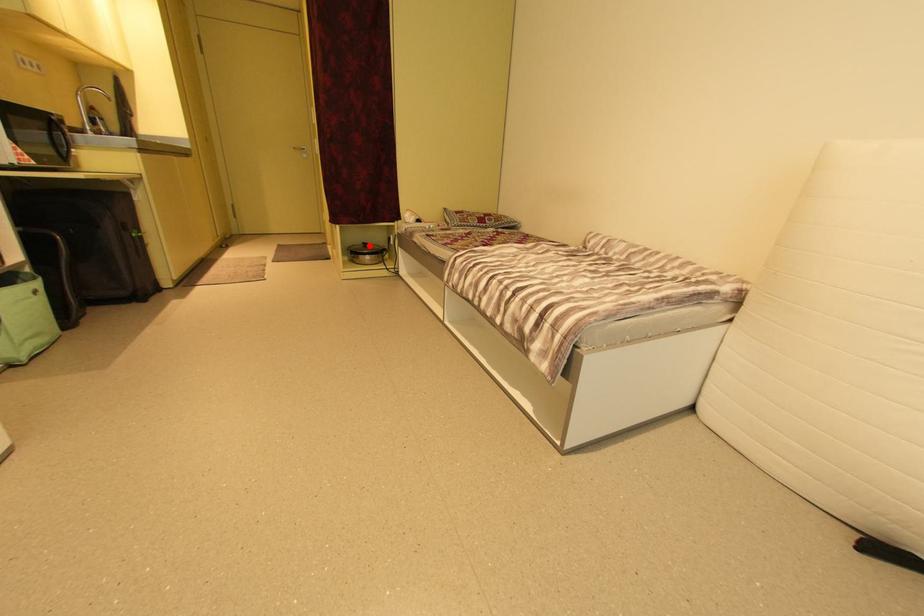
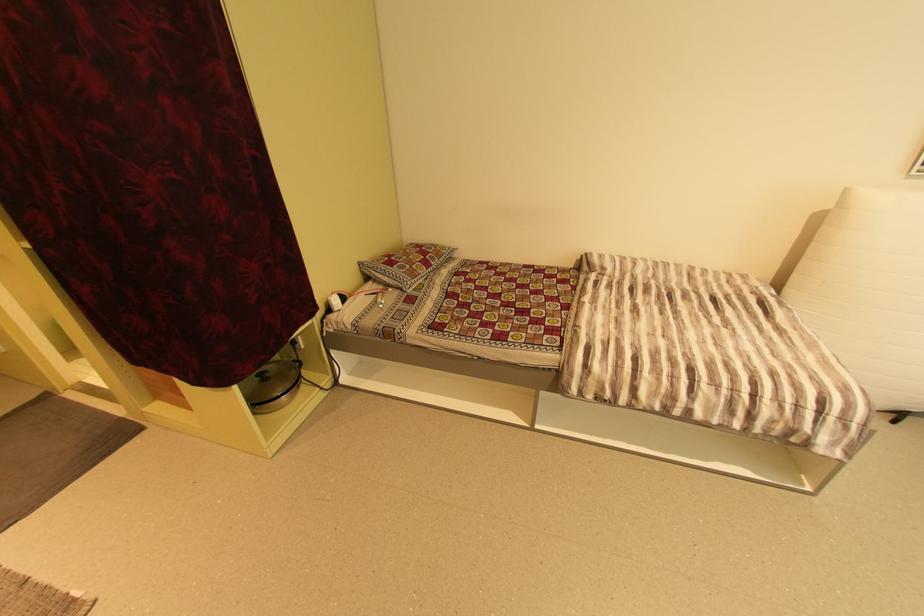
Locate, in the second image, the point that corresponds to the highlighted location in the first image.

(265, 379)